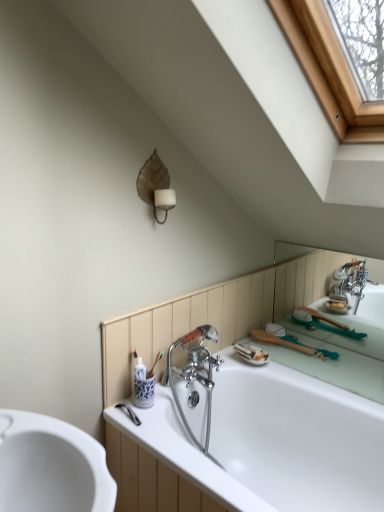
Question: In the image, is brown leaf-shaped sconce at upper center positioned in front of or behind white glossy bathtub at center?

Choices:
 (A) behind
 (B) front

Answer: (A)

Question: Considering the positions of brown leaf-shaped sconce at upper center and white glossy bathtub at center in the image, is brown leaf-shaped sconce at upper center taller or shorter than white glossy bathtub at center?

Choices:
 (A) short
 (B) tall

Answer: (A)

Question: Based on their positions, is brown leaf-shaped sconce at upper center located to the left or right of white glossy bathtub at center?

Choices:
 (A) left
 (B) right

Answer: (A)

Question: Considering the positions of white glossy bathtub at center and brown leaf-shaped sconce at upper center in the image, is white glossy bathtub at center taller or shorter than brown leaf-shaped sconce at upper center?

Choices:
 (A) tall
 (B) short

Answer: (A)

Question: From the image's perspective, is white glossy bathtub at center positioned above or below brown leaf-shaped sconce at upper center?

Choices:
 (A) above
 (B) below

Answer: (B)

Question: Is white glossy bathtub at center to the left or to the right of brown leaf-shaped sconce at upper center in the image?

Choices:
 (A) right
 (B) left

Answer: (A)

Question: Considering the positions of white glossy bathtub at center and brown leaf-shaped sconce at upper center in the image, is white glossy bathtub at center wider or thinner than brown leaf-shaped sconce at upper center?

Choices:
 (A) thin
 (B) wide

Answer: (B)